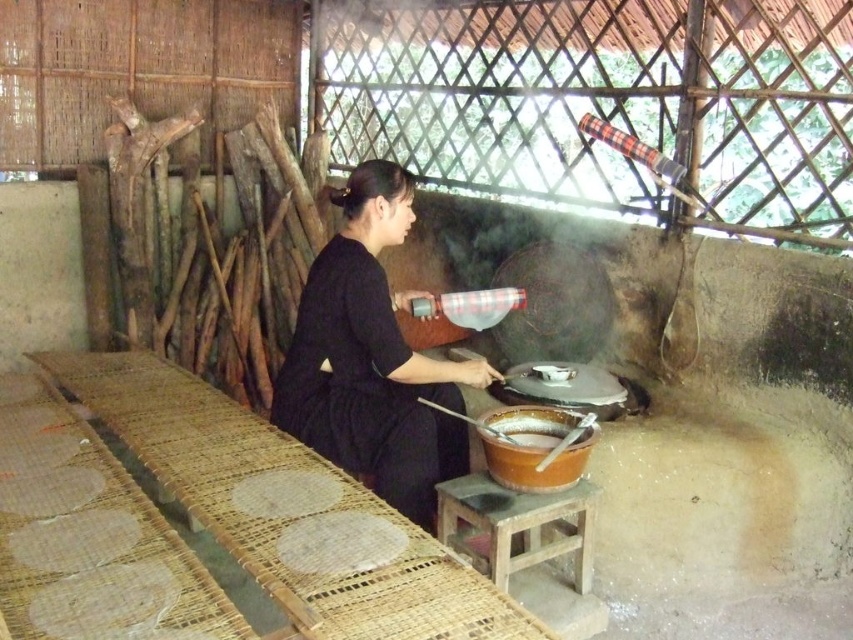
Is black matte dress at center wider than wooden stool at center?

Yes.

Does black matte dress at center appear on the left side of wooden stool at center?

Correct, you'll find black matte dress at center to the left of wooden stool at center.

Describe the element at coordinates (372, 358) in the screenshot. The width and height of the screenshot is (853, 640). I see `black matte dress at center` at that location.

This screenshot has width=853, height=640. What are the coordinates of `black matte dress at center` in the screenshot? It's located at (372, 358).

From the picture: Does wooden stool at center have a smaller size compared to brown matte wok at center?

Incorrect, wooden stool at center is not smaller in size than brown matte wok at center.

Who is taller, wooden stool at center or brown matte wok at center?

Standing taller between the two is wooden stool at center.

Which is behind, point (463, 545) or point (523, 464)?

The point (463, 545) is behind.

Where is `wooden stool at center`? wooden stool at center is located at coordinates (515, 525).

Is black matte dress at center positioned before brown matte wok at center?

No, it is not.

Is black matte dress at center positioned behind brown matte wok at center?

Yes, it is behind brown matte wok at center.

You are a GUI agent. You are given a task and a screenshot of the screen. Output one action in this format:
    pyautogui.click(x=<x>, y=<y>)
    Task: Click on the black matte dress at center
    The width and height of the screenshot is (853, 640).
    Given the screenshot: What is the action you would take?
    pyautogui.click(x=372, y=358)